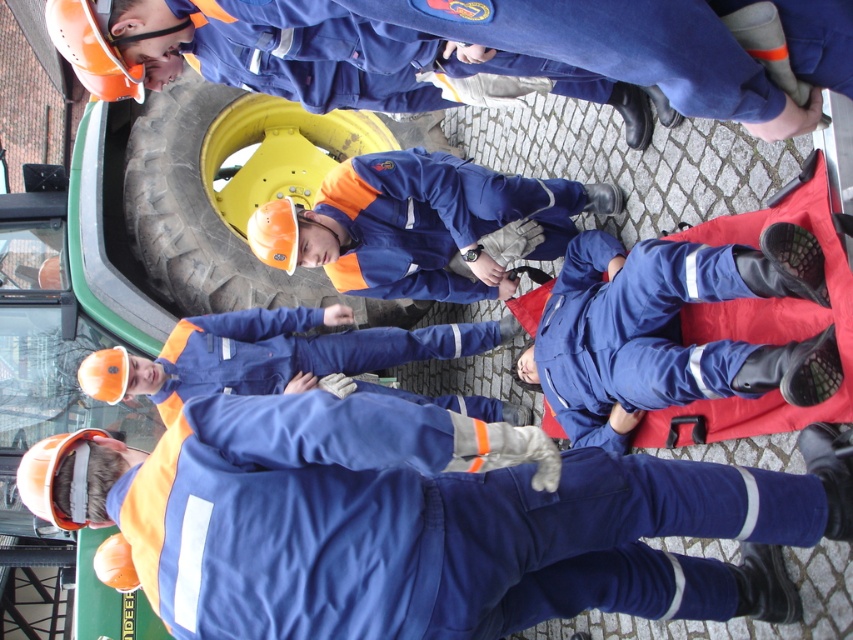
Question: Among these points, which one is farthest from the camera?

Choices:
 (A) (329, 264)
 (B) (207, 275)

Answer: (B)

Question: Does matte blue jumpsuit at center appear over yellow rubber tire at center?

Choices:
 (A) yes
 (B) no

Answer: (B)

Question: Does matte blue jumpsuit at center come in front of yellow rubber tire at center?

Choices:
 (A) no
 (B) yes

Answer: (B)

Question: Among these objects, which one is nearest to the camera?

Choices:
 (A) matte blue jumpsuit at center
 (B) yellow rubber tire at center

Answer: (A)

Question: Can you confirm if matte blue jumpsuit at center is positioned above yellow rubber tire at center?

Choices:
 (A) yes
 (B) no

Answer: (B)